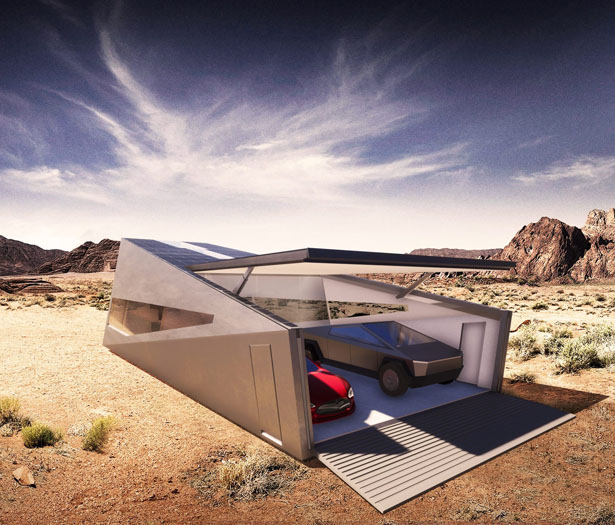
This screenshot has width=615, height=525. I want to click on wall, so click(443, 325).